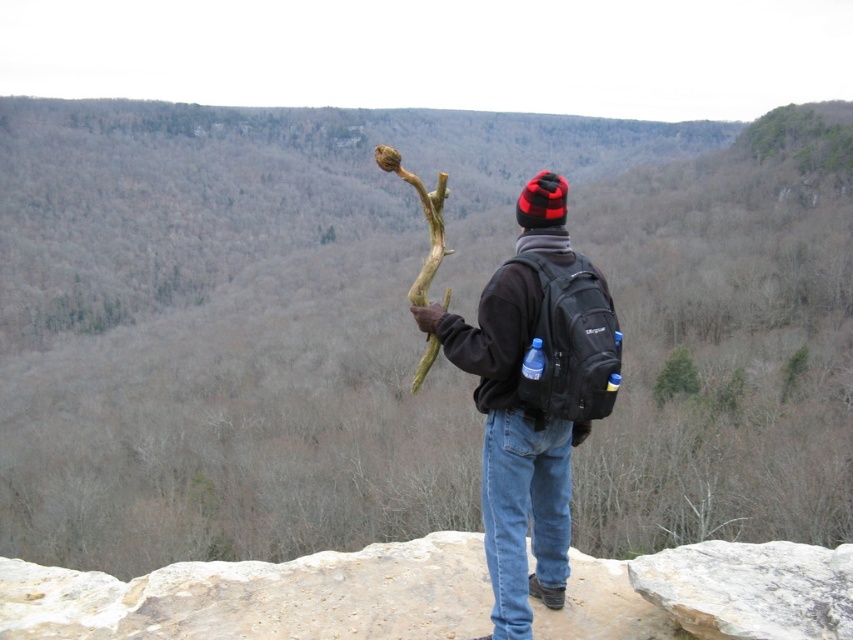
You are a hiker who just arrived at the rocky outcrop. You want to place your black fleece jacket at center on a stable surface. Can you put it on the brown rough branch at center?

The black fleece jacket at center cannot be placed on the brown rough branch at center because the jacket is positioned under the branch, meaning the branch is above it and not a suitable surface for placing the jacket.

In the scene shown: You are a hiker who wants to compare the size of the items you are carrying. Which item is wider, the black fleece jacket at center or the brown rough branch at center?

The brown rough branch at center is wider than the black fleece jacket at center.